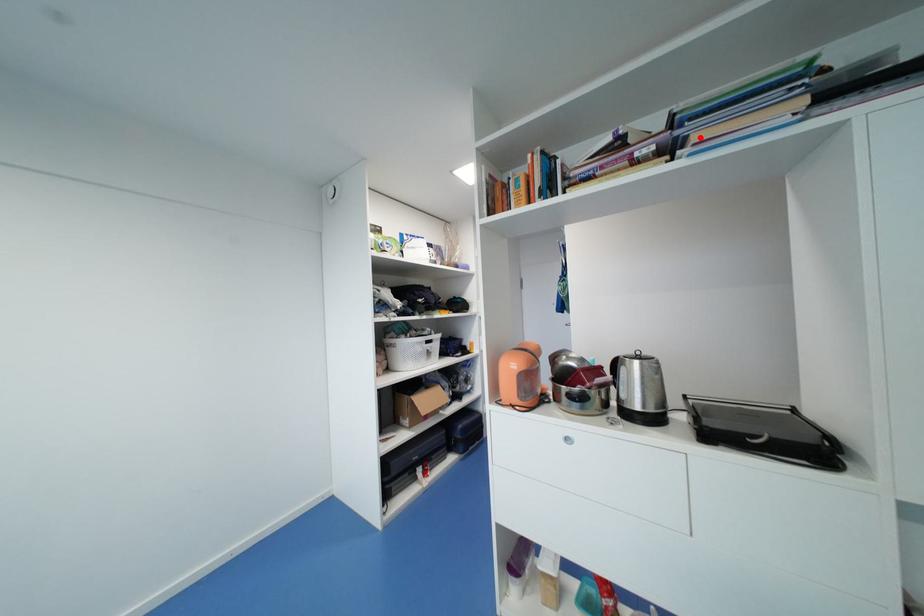
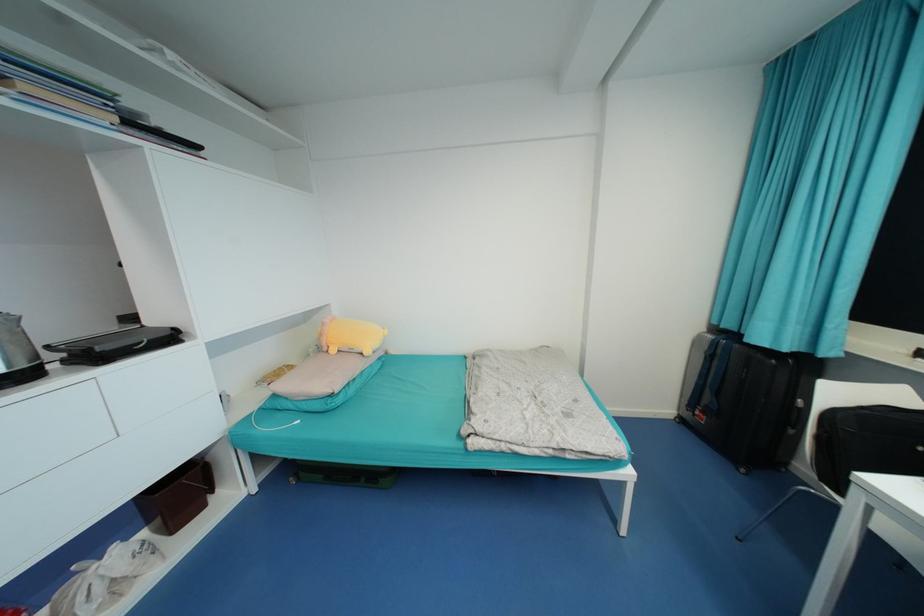
Question: A red point is marked in image1. In image2, is the corresponding 3D point closer to the camera or farther? Reply with the corresponding letter.

Choices:
 (A) The corresponding 3D point is closer.
 (B) The corresponding 3D point is farther.

Answer: (B)